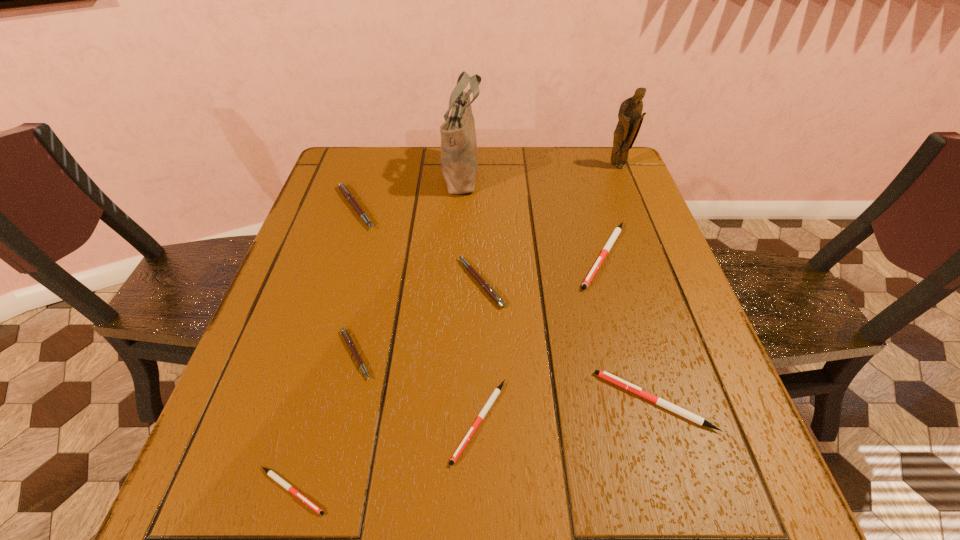
Where is `vacant region between the biggest pink pen and the figurine`? vacant region between the biggest pink pen and the figurine is located at coordinates pyautogui.click(x=487, y=187).

Locate an element on the screen. unoccupied position between the second biggest pink pen and the second biggest white pen is located at coordinates (567, 342).

I want to click on free space between the smallest pink pen and the second biggest white pen, so click(x=505, y=377).

Where is `vacant area that lies between the second biggest white pen and the shoulder bag`? The image size is (960, 540). vacant area that lies between the second biggest white pen and the shoulder bag is located at coordinates (559, 286).

You are a GUI agent. You are given a task and a screenshot of the screen. Output one action in this format:
    pyautogui.click(x=<x>, y=<y>)
    Task: Click on the vacant point located between the tan shoulder bag and the shortest object
    
    Given the screenshot: What is the action you would take?
    pyautogui.click(x=377, y=331)

Find the location of a particular element. empty space that is in between the second biggest white pen and the third white pen from right to left is located at coordinates (566, 411).

Where is `vacant region between the eighth shortest object and the smallest white pen`? Image resolution: width=960 pixels, height=540 pixels. vacant region between the eighth shortest object and the smallest white pen is located at coordinates (455, 329).

Where is `empty space between the farthest pink pen and the second smallest pink pen`? empty space between the farthest pink pen and the second smallest pink pen is located at coordinates (418, 245).

Choose which object is the fifth nearest neighbor to the figurine. Please provide its 2D coordinates. Your answer should be formatted as a tuple, i.e. [(x, y)], where the tuple contains the x and y coordinates of a point satisfying the conditions above.

[(605, 375)]

Locate which object ranks in proximity to the figurine. Please provide its 2D coordinates. Your answer should be formatted as a tuple, i.e. [(x, y)], where the tuple contains the x and y coordinates of a point satisfying the conditions above.

[(616, 232)]